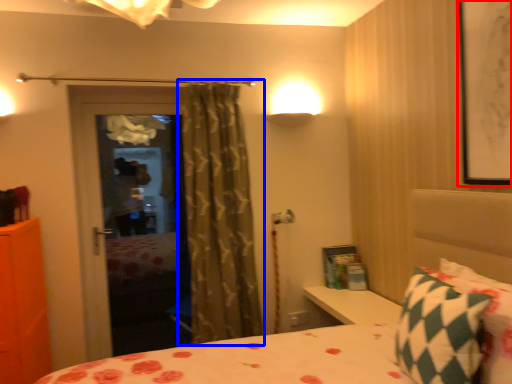
Question: Which object is further to the camera taking this photo, picture frame (highlighted by a red box) or curtain (highlighted by a blue box)?

Choices:
 (A) picture frame
 (B) curtain

Answer: (B)